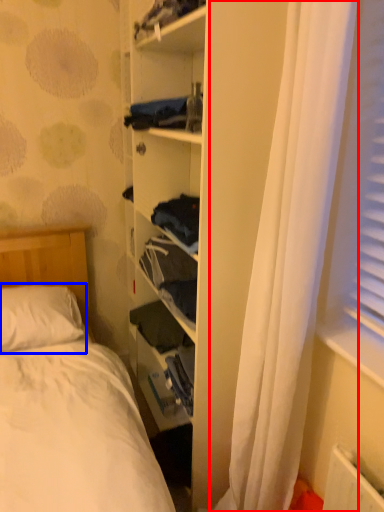
Question: Which of the following is the farthest to the observer, curtain (highlighted by a red box) or pillow (highlighted by a blue box)?

Choices:
 (A) curtain
 (B) pillow

Answer: (B)